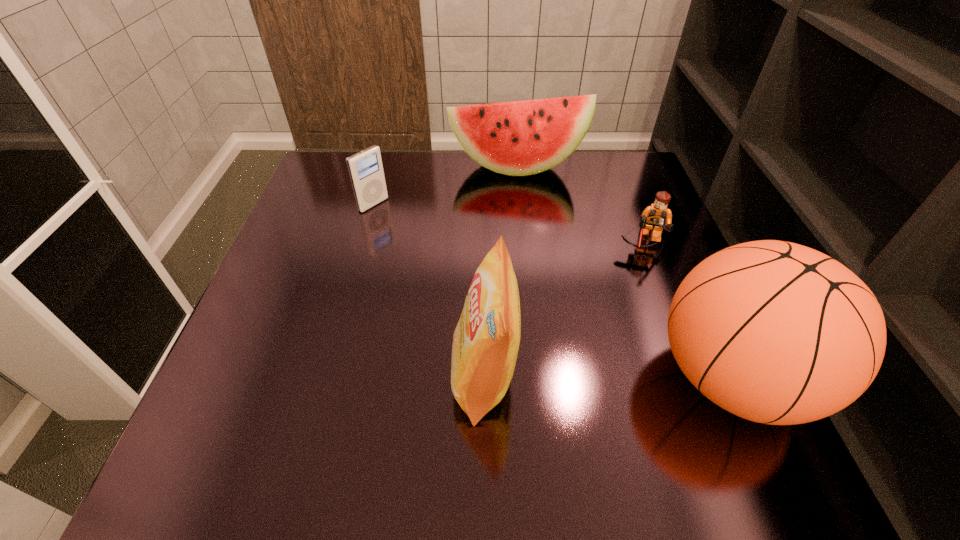
The height and width of the screenshot is (540, 960). What are the coordinates of `crisp (potato chip)` in the screenshot? It's located at (486, 340).

This screenshot has height=540, width=960. In order to click on basketball in this screenshot , I will do `click(778, 333)`.

Identify the location of the third farthest object. This screenshot has height=540, width=960. (656, 217).

This screenshot has width=960, height=540. Find the location of `the shortest object`. the shortest object is located at coordinates (656, 217).

Find the location of a particular element. watermelon is located at coordinates (519, 138).

Identify the location of the farthest object. Image resolution: width=960 pixels, height=540 pixels. (519, 138).

You are a GUI agent. You are given a task and a screenshot of the screen. Output one action in this format:
    pyautogui.click(x=<x>, y=<y>)
    Task: Click on the second shortest object
    
    Given the screenshot: What is the action you would take?
    pyautogui.click(x=365, y=168)

Identify the location of iPod. (365, 168).

Locate an element on the screen. free space located 0.270m on the front-facing side of the crisp (potato chip) is located at coordinates [300, 377].

Locate an element on the screen. vacant space positioned on the front-facing side of the crisp (potato chip) is located at coordinates (329, 377).